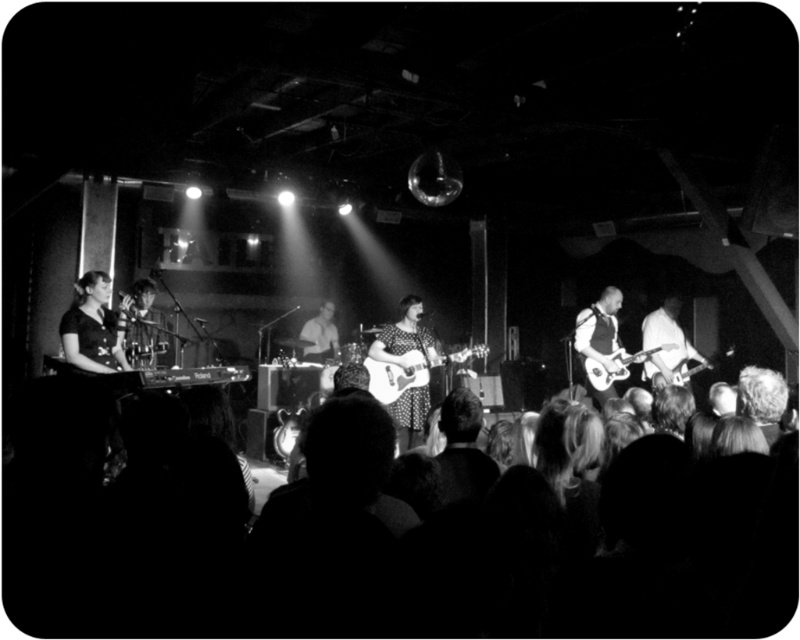
You are standing 2 meters away from the stage in the venue. There is a point at coordinates point (150, 541) that you want to reach. Can you walk to that point without getting closer than 1.5 meters to the stage?

The distance of point (150, 541) from viewer is 1.73 meters. Since you are currently 2 meters away from the stage, moving to that point would bring you closer to the stage by 0.27 meters, making your distance 1.73 meters. This is still above the 1.5 meters minimum distance requirement, so yes, you can walk to that point without violating the distance rule.